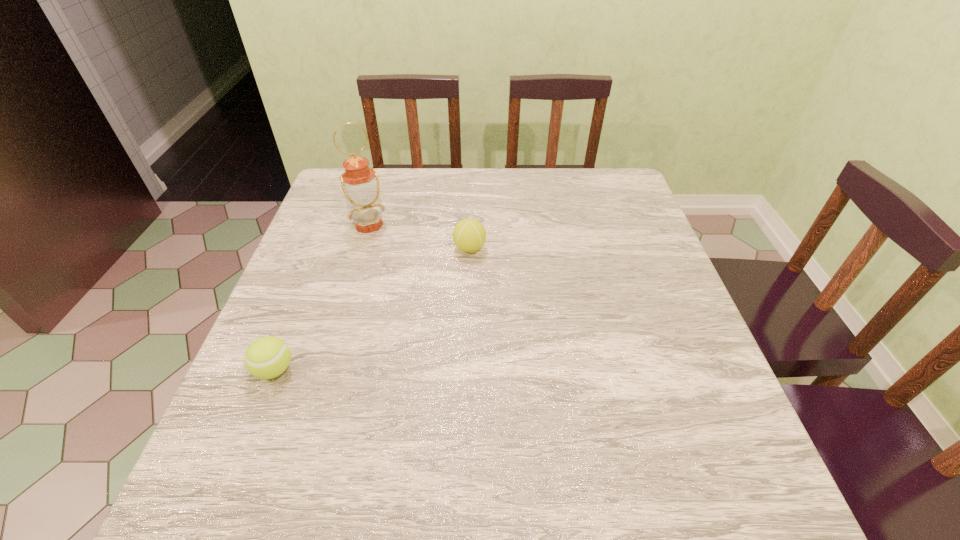
The image size is (960, 540). I want to click on vacant space that satisfies the following two spatial constraints: 1. on the back side of the farther tennis ball; 2. on the right side of the left tennis ball, so click(323, 248).

At what (x,y) coordinates should I click in order to perform the action: click on free region that satisfies the following two spatial constraints: 1. on the back side of the right tennis ball; 2. on the left side of the nearer tennis ball. Please return your answer as a coordinate pair (x, y). Image resolution: width=960 pixels, height=540 pixels. Looking at the image, I should click on (323, 248).